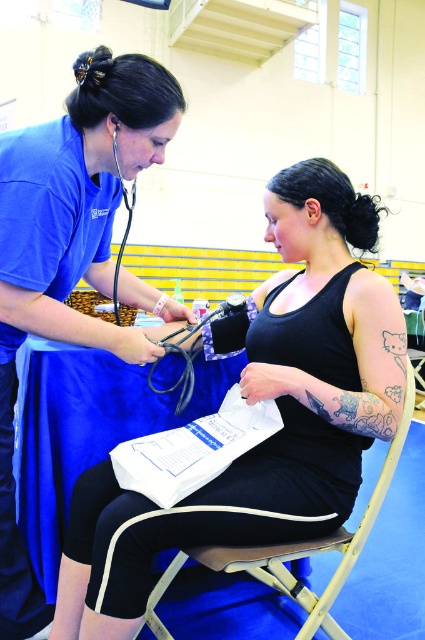
You are a photographer positioned in the gymnasium. You need to capture a photo where both the matte blue shirt at upper left and the metallic silver chair at center are visible. Which object should you focus on first to ensure both are in frame?

The matte blue shirt at upper left is taller than the metallic silver chair at center, so focus on the matte blue shirt at upper left first to ensure both are in frame.

Based on the coordinates provided, which object is located at point [261,400] in the scene?

The point at coordinates [261,400] corresponds to the black matte tank top at center.